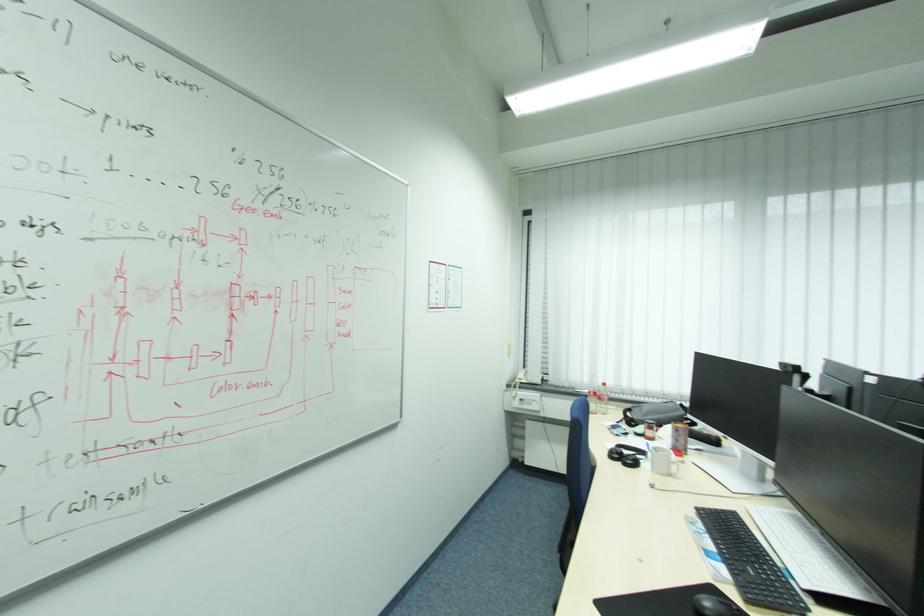
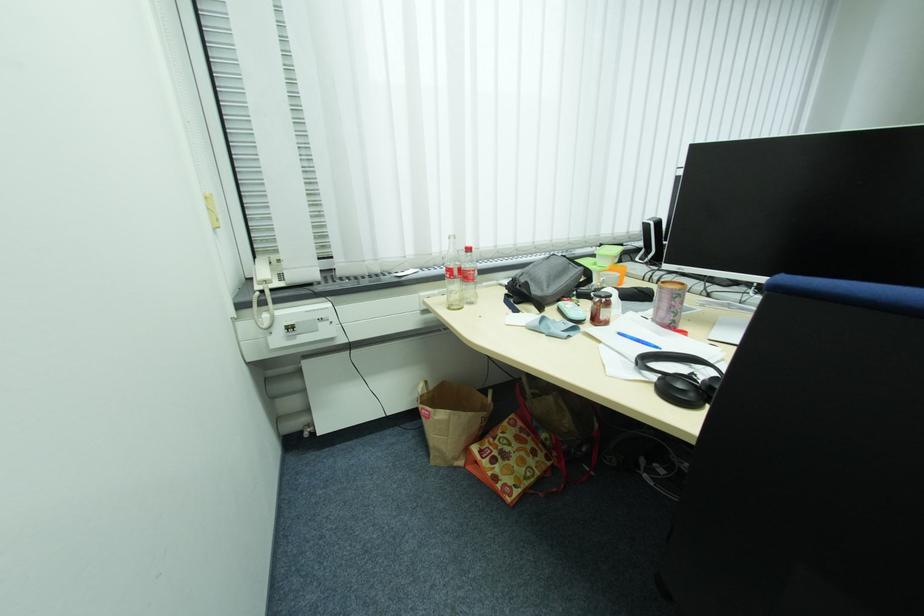
Where in the second image is the point corresponding to the point at 684,427 from the first image?

(687, 290)